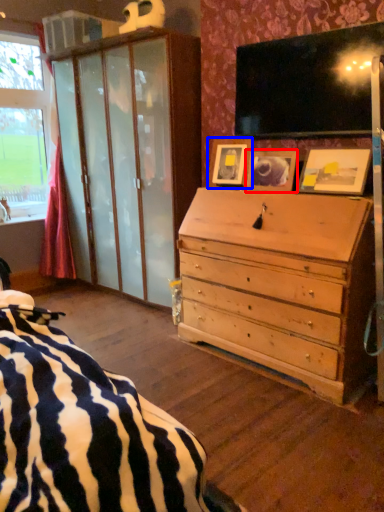
Question: Which point is closer to the camera, picture frame (highlighted by a red box) or picture frame (highlighted by a blue box)?

Choices:
 (A) picture frame
 (B) picture frame

Answer: (A)